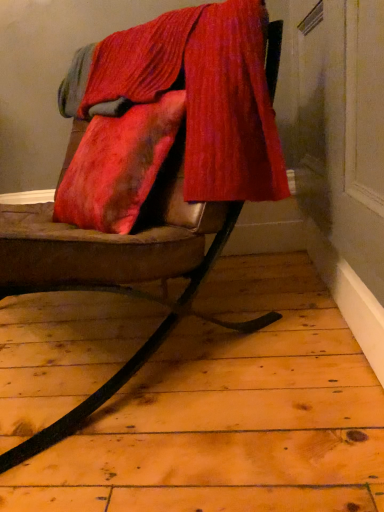
Question: Is leather cushion at center positioned beyond the bounds of velvetvelvetvelvet at upper center?

Choices:
 (A) no
 (B) yes

Answer: (B)

Question: Does leather cushion at center appear on the left side of velvetvelvetvelvet at upper center?

Choices:
 (A) no
 (B) yes

Answer: (B)

Question: From the image's perspective, is leather cushion at center on top of velvetvelvetvelvet at upper center?

Choices:
 (A) no
 (B) yes

Answer: (A)

Question: Considering the relative sizes of leather cushion at center and velvetvelvetvelvet at upper center in the image provided, is leather cushion at center smaller than velvetvelvetvelvet at upper center?

Choices:
 (A) yes
 (B) no

Answer: (B)

Question: Does leather cushion at center touch velvetvelvetvelvet at upper center?

Choices:
 (A) yes
 (B) no

Answer: (B)

Question: Considering the relative sizes of leather cushion at center and velvetvelvetvelvet at upper center in the image provided, is leather cushion at center wider than velvetvelvetvelvet at upper center?

Choices:
 (A) no
 (B) yes

Answer: (B)

Question: Is velvetvelvetvelvet at upper center outside leather cushion at center?

Choices:
 (A) yes
 (B) no

Answer: (B)

Question: Is velvetvelvetvelvet at upper center wider than leather cushion at center?

Choices:
 (A) yes
 (B) no

Answer: (B)

Question: From the image's perspective, is velvetvelvetvelvet at upper center above leather cushion at center?

Choices:
 (A) no
 (B) yes

Answer: (B)

Question: From the image's perspective, does velvetvelvetvelvet at upper center appear lower than leather cushion at center?

Choices:
 (A) yes
 (B) no

Answer: (B)

Question: Does velvetvelvetvelvet at upper center turn towards leather cushion at center?

Choices:
 (A) yes
 (B) no

Answer: (A)

Question: Are velvetvelvetvelvet at upper center and leather cushion at center far apart?

Choices:
 (A) yes
 (B) no

Answer: (B)

Question: In terms of height, does leather cushion at center look taller or shorter compared to velvetvelvetvelvet at upper center?

Choices:
 (A) short
 (B) tall

Answer: (B)